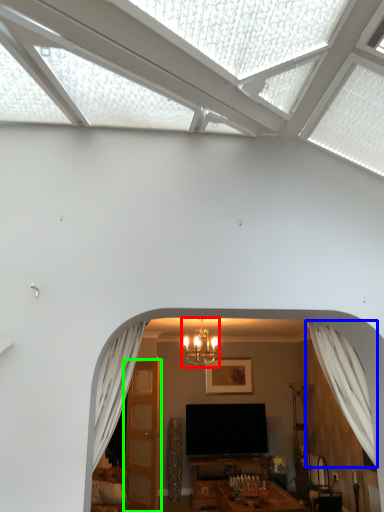
Question: Estimate the real-world distances between objects in this image. Which object is farther from light fixture (highlighted by a red box), curtain (highlighted by a blue box) or door (highlighted by a green box)?

Choices:
 (A) curtain
 (B) door

Answer: (A)